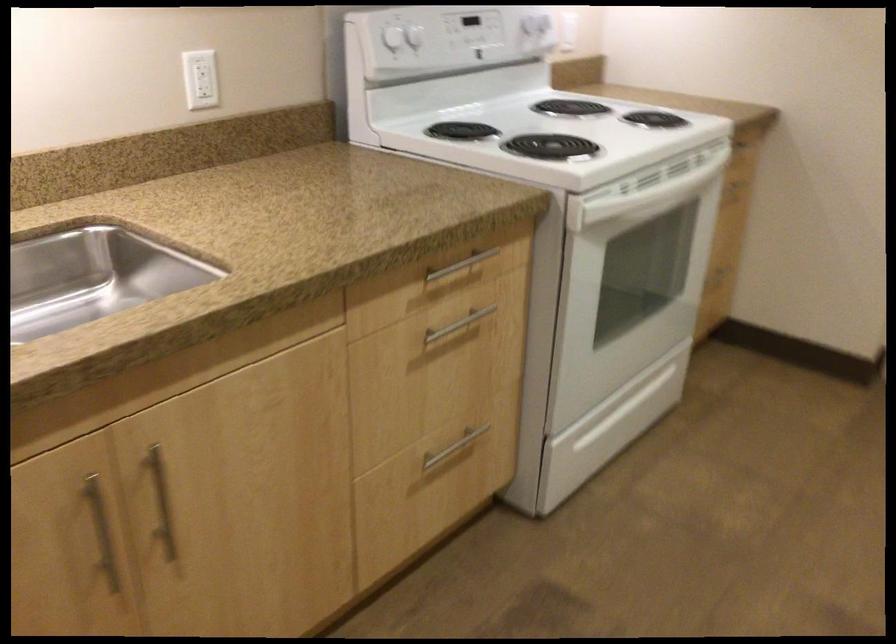
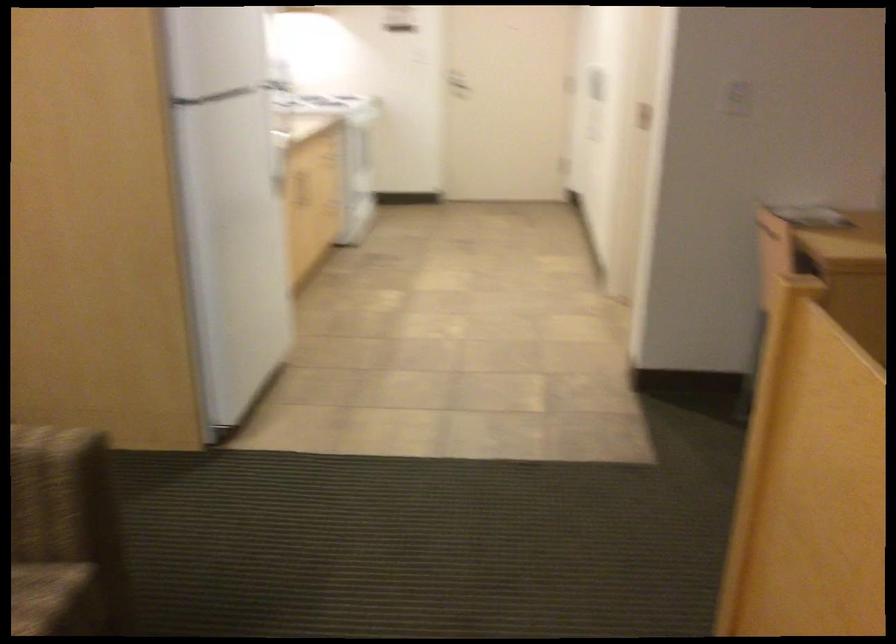
Question: I am providing you with two images of the same scene from different viewpoints. Please identify which objects are invisible in image2.

Choices:
 (A) light green cushion
 (B) white stove knob
 (C) door handle
 (D) wooden cabinet handle

Answer: (B)